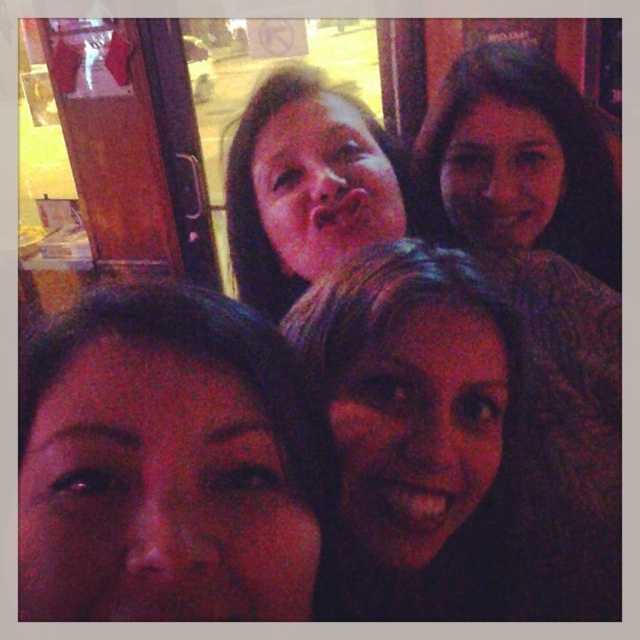
Who is taller, dark hair at upper right or matte skin at center?

dark hair at upper right

Who is lower down, dark hair at upper right or matte skin at center?

dark hair at upper right

At what (x,y) coordinates should I click in order to perform the action: click on dark hair at upper right. Please return your answer as a coordinate pair (x, y). The width and height of the screenshot is (640, 640). Looking at the image, I should click on (545, 285).

Can you confirm if dark brown hair at upper right is shorter than matte skin at center?

No.

Does dark brown hair at upper right have a larger size compared to matte skin at center?

Correct, dark brown hair at upper right is larger in size than matte skin at center.

You are a GUI agent. You are given a task and a screenshot of the screen. Output one action in this format:
    pyautogui.click(x=<x>, y=<y>)
    Task: Click on the dark brown hair at upper right
    The height and width of the screenshot is (640, 640).
    Given the screenshot: What is the action you would take?
    pyautogui.click(x=520, y=161)

Which of these two, dark hair at upper right or dark brown hair at upper right, stands shorter?

Standing shorter between the two is dark brown hair at upper right.

Is dark hair at upper right smaller than dark brown hair at upper right?

No, dark hair at upper right is not smaller than dark brown hair at upper right.

Does point (460, 205) lie in front of point (593, 256)?

Yes, it is in front of point (593, 256).

Identify the location of dark hair at upper right. Image resolution: width=640 pixels, height=640 pixels. (545, 285).